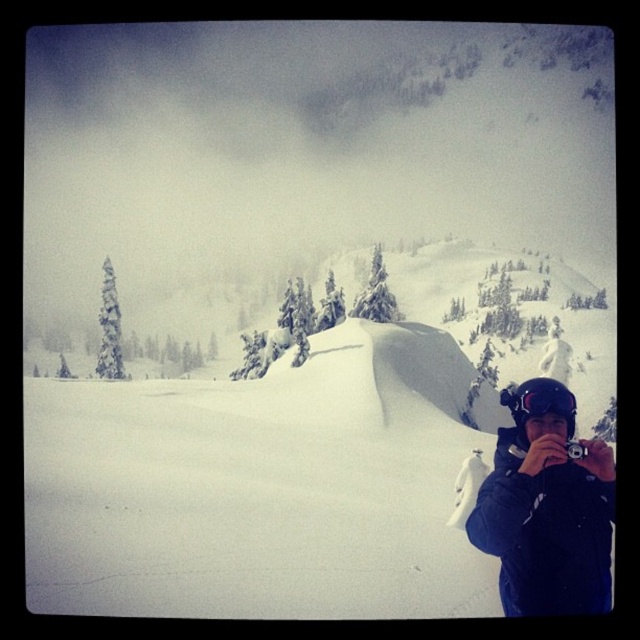
Question: Considering the real-world distances, which object is farthest from the black plastic camera at lower right?

Choices:
 (A) white fluffy snow at center
 (B) black matte goggles at lower right
 (C) dark blue jacket at lower right

Answer: (A)

Question: Which of the following is the farthest from the observer?

Choices:
 (A) (564, 445)
 (B) (164, 513)
 (C) (518, 412)

Answer: (B)

Question: Is white fluffy snow at center to the left of dark blue jacket at lower right from the viewer's perspective?

Choices:
 (A) no
 (B) yes

Answer: (B)

Question: Where is white fluffy snow at center located in relation to black plastic camera at lower right in the image?

Choices:
 (A) above
 (B) below

Answer: (A)

Question: Which object is the closest to the black matte goggles at lower right?

Choices:
 (A) dark blue jacket at lower right
 (B) black plastic camera at lower right
 (C) white fluffy snow at center

Answer: (B)

Question: Can you confirm if dark blue jacket at lower right is positioned above black matte goggles at lower right?

Choices:
 (A) yes
 (B) no

Answer: (B)